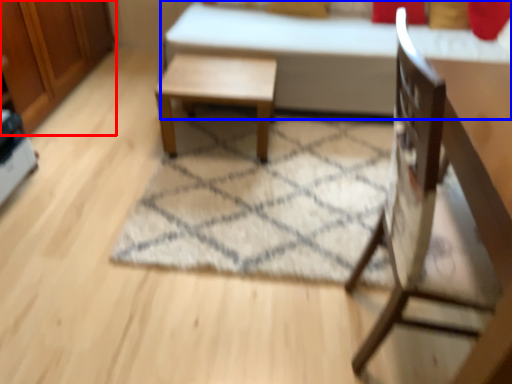
Question: Which object appears closest to the camera in this image, dresser (highlighted by a red box) or bed (highlighted by a blue box)?

Choices:
 (A) dresser
 (B) bed

Answer: (A)